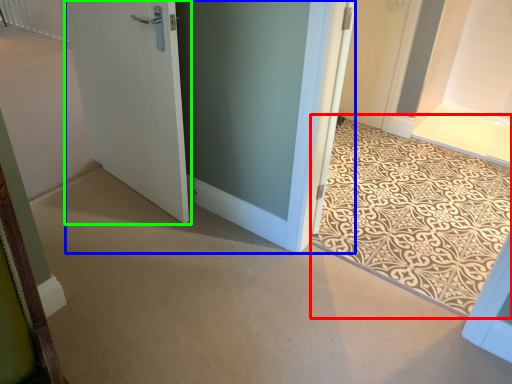
Question: Based on their relative distances, which object is farther from doormat (highlighted by a red box)? Choose from door (highlighted by a blue box) and door (highlighted by a green box).

Choices:
 (A) door
 (B) door

Answer: (B)